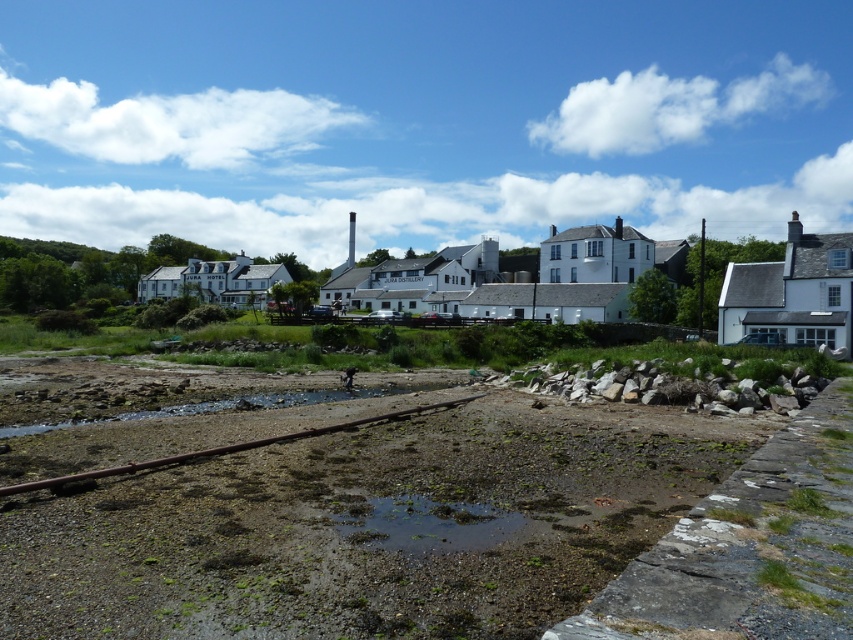
Is dull brown mud at lower center positioned before rusty metal train track at lower center?

Yes, dull brown mud at lower center is closer to the viewer.

Is dull brown mud at lower center thinner than rusty metal train track at lower center?

No.

Is point (395, 468) positioned after point (49, 484)?

That is True.

This screenshot has height=640, width=853. I want to click on dull brown mud at lower center, so click(368, 525).

Can you confirm if dull brown mud at lower center is positioned above white matte building at center?

Incorrect, dull brown mud at lower center is not positioned above white matte building at center.

Consider the image. Between dull brown mud at lower center and white matte building at center, which one appears on the left side from the viewer's perspective?

Positioned to the left is dull brown mud at lower center.

Which is in front, point (596, 444) or point (784, 273)?

Point (596, 444)

Identify the location of dull brown mud at lower center. This screenshot has width=853, height=640. (368, 525).

Does green mossy water at center lie behind rusty metal train track at lower center?

That is False.

The width and height of the screenshot is (853, 640). Find the location of `green mossy water at center`. green mossy water at center is located at coordinates (426, 524).

Is point (461, 538) positioned after point (289, 433)?

No, (461, 538) is in front of (289, 433).

Locate an element on the screen. The image size is (853, 640). green mossy water at center is located at coordinates (426, 524).